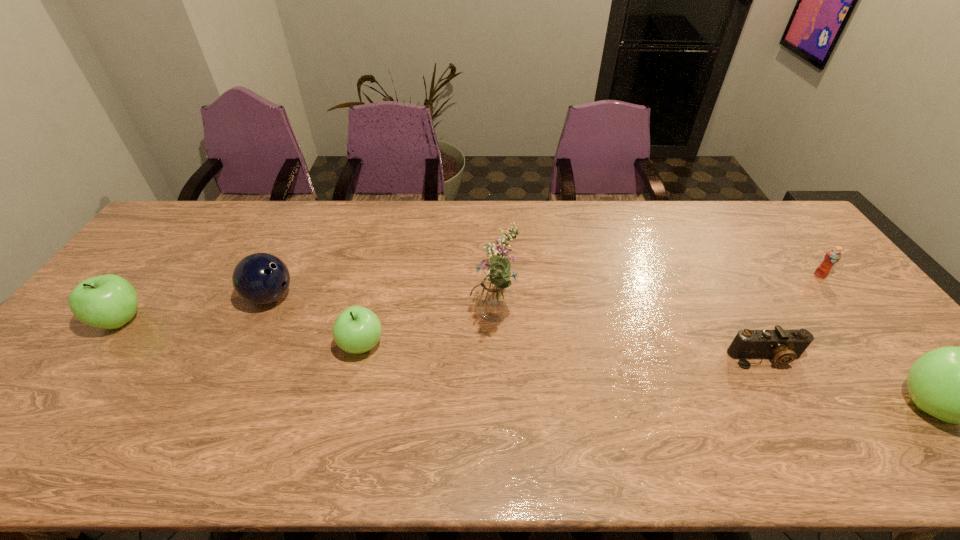
This screenshot has height=540, width=960. In order to click on free space located 0.370m on the right of the leftmost object in this screenshot , I will do `click(280, 320)`.

At what (x,y) coordinates should I click in order to perform the action: click on vacant space located on the right of the fifth object from right to left. Please return your answer as a coordinate pair (x, y). The height and width of the screenshot is (540, 960). Looking at the image, I should click on (499, 346).

You are a GUI agent. You are given a task and a screenshot of the screen. Output one action in this format:
    pyautogui.click(x=<x>, y=<y>)
    Task: Click on the free region located on the front of the farthest object
    This screenshot has height=540, width=960.
    Given the screenshot: What is the action you would take?
    pyautogui.click(x=917, y=397)

Where is `vacant region located 0.340m on the front-facing side of the tallest object`? This screenshot has height=540, width=960. vacant region located 0.340m on the front-facing side of the tallest object is located at coordinates (347, 322).

The image size is (960, 540). What are the coordinates of `free region located on the front-facing side of the tallest object` in the screenshot? It's located at (426, 322).

Locate an element on the screen. The width and height of the screenshot is (960, 540). vacant space located 0.120m on the front-facing side of the tallest object is located at coordinates (426, 322).

Identify the location of vacant point located on the front-facing side of the camera. The image size is (960, 540). (795, 410).

I want to click on blank area located on the surface of the bowling ball near the finger holes, so [x=378, y=297].

At what (x,y) coordinates should I click in order to perform the action: click on object present at the left edge. Please return your answer as a coordinate pair (x, y). The image size is (960, 540). Looking at the image, I should click on (109, 301).

Locate an element on the screen. object that is positioned at the right edge is located at coordinates (833, 256).